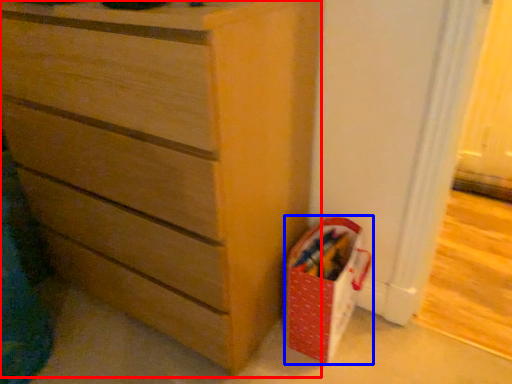
Question: Which object appears closest to the camera in this image, chest of drawers (highlighted by a red box) or kit (highlighted by a blue box)?

Choices:
 (A) chest of drawers
 (B) kit

Answer: (A)